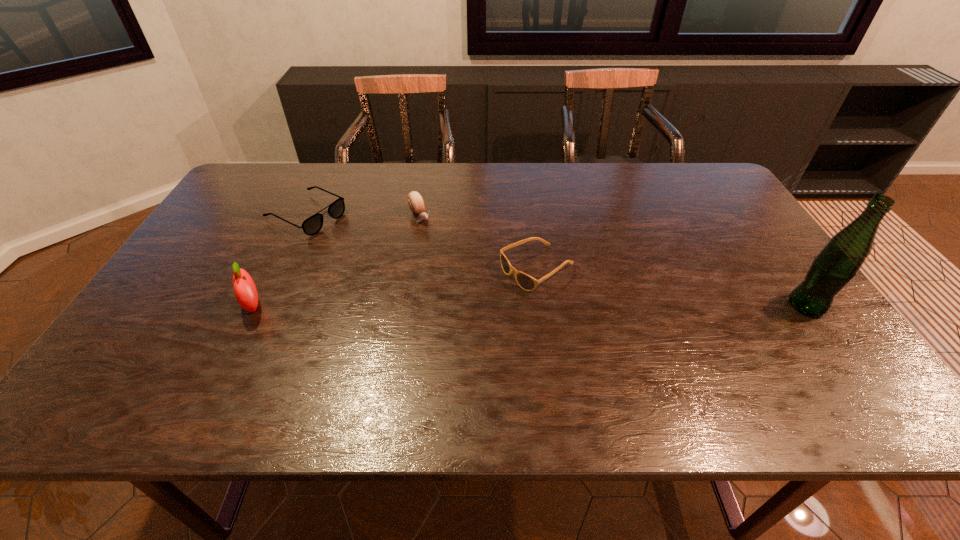
Identify the location of free space on the desktop that is between the apple and the rightmost object and is positioned on the front-facing side of the escargot. The height and width of the screenshot is (540, 960). (486, 306).

I want to click on vacant spot on the desktop that is between the apple and the rightmost object and is positioned on the front-facing side of the spectacles, so click(x=500, y=306).

Identify the location of vacant space on the desktop that is between the fourth shortest object and the beer bottle and is positioned on the front-facing side of the fourth object from left to right. Image resolution: width=960 pixels, height=540 pixels. (x=470, y=306).